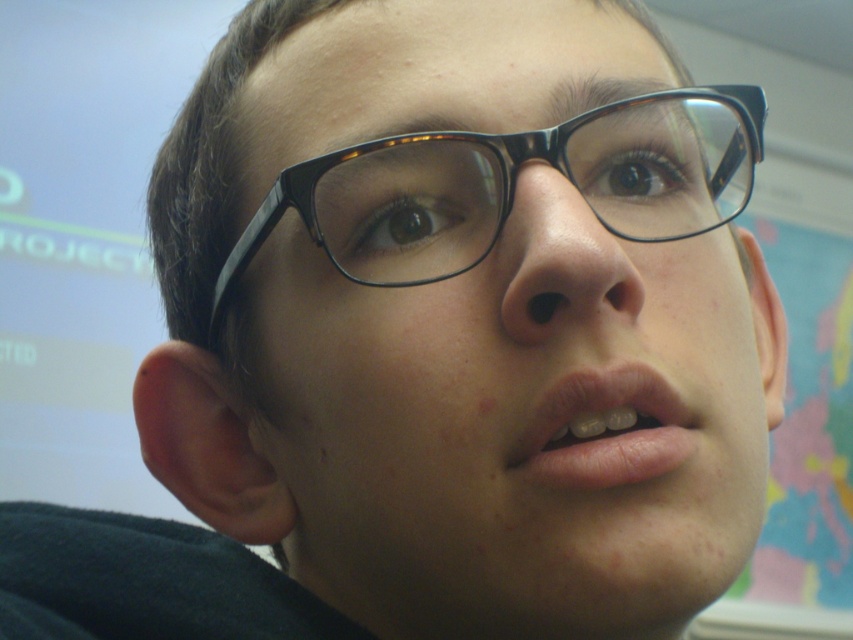
Is matte skin nose at center to the left of pink matte lips at center from the viewer's perspective?

Yes, matte skin nose at center is to the left of pink matte lips at center.

Does point (550, 273) come behind point (685, 428)?

No, it is in front of (685, 428).

The image size is (853, 640). What are the coordinates of `matte skin nose at center` in the screenshot? It's located at (560, 262).

Does black plastic glasses at center have a greater width compared to tortoiseshell/black frame glasses at center?

Yes.

Describe the element at coordinates (569, 397) in the screenshot. I see `black plastic glasses at center` at that location.

Find the location of a particular element. The width and height of the screenshot is (853, 640). black plastic glasses at center is located at coordinates (569, 397).

Locate an element on the screen. The image size is (853, 640). black plastic glasses at center is located at coordinates (569, 397).

Between point (453, 225) and point (672, 392), which one is positioned behind?

Point (453, 225)

Can you confirm if tortoiseshell/black frame glasses at center is bigger than pink matte lips at center?

Indeed, tortoiseshell/black frame glasses at center has a larger size compared to pink matte lips at center.

The width and height of the screenshot is (853, 640). I want to click on tortoiseshell/black frame glasses at center, so click(x=514, y=186).